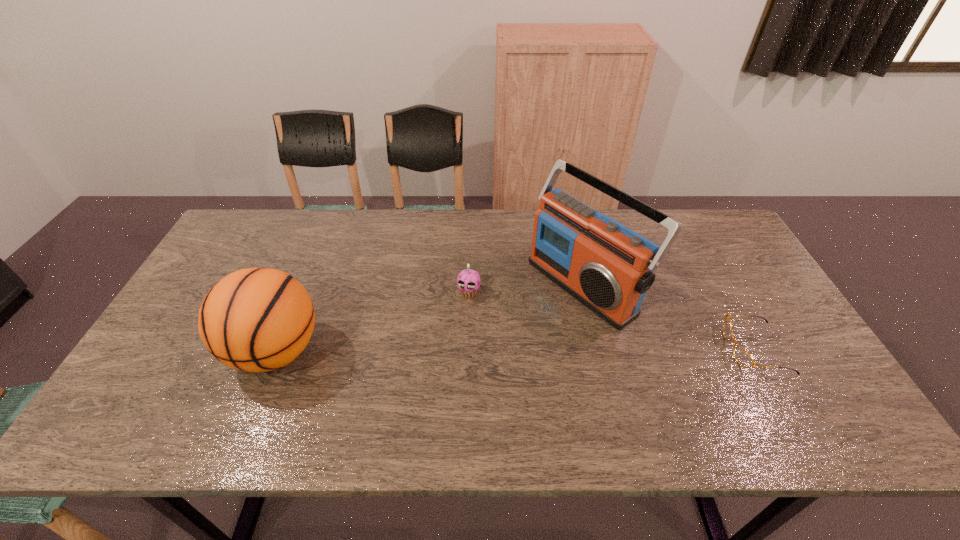
Find the location of a particular element. spectacles that is at the near edge is located at coordinates (744, 359).

Identify the location of object that is at the right edge. (744, 359).

Identify the location of object at the near right corner. (744, 359).

In the image, there is a desktop. At what (x,y) coordinates should I click in order to perform the action: click on vacant space at the far edge. Please return your answer as a coordinate pair (x, y). Looking at the image, I should click on (x=389, y=231).

Identify the location of vacant region at the near edge of the desktop. The height and width of the screenshot is (540, 960). (667, 379).

You are a GUI agent. You are given a task and a screenshot of the screen. Output one action in this format:
    pyautogui.click(x=<x>, y=<y>)
    Task: Click on the free space at the left edge
    The width and height of the screenshot is (960, 540).
    Given the screenshot: What is the action you would take?
    pyautogui.click(x=241, y=255)

Image resolution: width=960 pixels, height=540 pixels. In the image, there is a desktop. In order to click on vacant space at the right edge in this screenshot , I will do [x=748, y=268].

Identify the location of vacant region at the near right corner of the desktop. The image size is (960, 540). (818, 376).

You are a GUI agent. You are given a task and a screenshot of the screen. Output one action in this format:
    pyautogui.click(x=<x>, y=<y>)
    Task: Click on the free space between the third shortest object and the third tallest object
    Image resolution: width=960 pixels, height=540 pixels.
    Given the screenshot: What is the action you would take?
    pyautogui.click(x=372, y=322)

Locate an element on the screen. vacant area between the second shortest object and the second object from right to left is located at coordinates (527, 288).